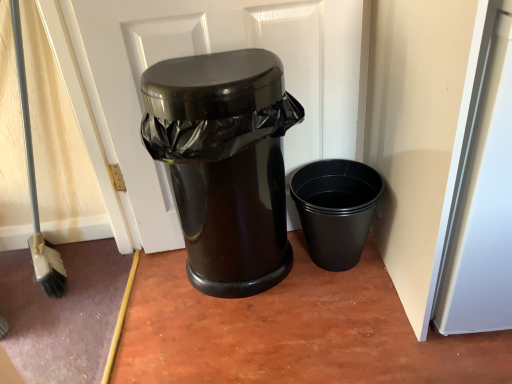
Where is `glossy black trash can at center`? This screenshot has width=512, height=384. glossy black trash can at center is located at coordinates (210, 52).

This screenshot has height=384, width=512. Find the location of `glossy black trash can at center`. glossy black trash can at center is located at coordinates (210, 52).

Is point (341, 258) positioned after point (266, 263)?

Yes, it is.

Considering the positions of objects black matte plastic cup at right, positioned as the second waste container in left-to-right order, and glossy black trash can at center, which is the 1th waste container in left-to-right order, in the image provided, who is more to the right, black matte plastic cup at right, positioned as the second waste container in left-to-right order, or glossy black trash can at center, which is the 1th waste container in left-to-right order,?

black matte plastic cup at right, positioned as the second waste container in left-to-right order.

Could you measure the distance between black matte plastic cup at right, placed as the 1th waste container when sorted from right to left, and glossy black trash can at center, which ranks as the 2th waste container in right-to-left order?

10.42 inches.

From the image's perspective, which waste container is the 2nd one below the glossy black trash can at center? Please provide its 2D coordinates.

[(336, 209)]

Is glossy black trash can at center a part of black matte plastic cup at right, placed as the 1th waste container when sorted from right to left?

No, glossy black trash can at center is not inside black matte plastic cup at right, placed as the 1th waste container when sorted from right to left.

How many degrees apart are the facing directions of black matte plastic cup at right, positioned as the second waste container in left-to-right order, and glossy black trash can at center?

The angular difference between black matte plastic cup at right, positioned as the second waste container in left-to-right order, and glossy black trash can at center is 0.00309 degrees.

Does glossy black trash can at center, which ranks as the 2th waste container in right-to-left order, have a larger size compared to black matte plastic cup at right, placed as the 1th waste container when sorted from right to left?

Indeed, glossy black trash can at center, which ranks as the 2th waste container in right-to-left order, has a larger size compared to black matte plastic cup at right, placed as the 1th waste container when sorted from right to left.

Can you confirm if glossy black trash can at center, which is the 1th waste container in left-to-right order, is wider than black matte plastic cup at right, placed as the 1th waste container when sorted from right to left?

No, glossy black trash can at center, which is the 1th waste container in left-to-right order, is not wider than black matte plastic cup at right, placed as the 1th waste container when sorted from right to left.

Is glossy black trash can at center, which is the 1th waste container in left-to-right order, not within black matte plastic cup at right, positioned as the second waste container in left-to-right order?

Yes, glossy black trash can at center, which is the 1th waste container in left-to-right order, is outside of black matte plastic cup at right, positioned as the second waste container in left-to-right order.

Can you confirm if glossy black trash can at center is wider than glossy black trash can at center, which ranks as the 2th waste container in right-to-left order?

Incorrect, the width of glossy black trash can at center does not surpass that of glossy black trash can at center, which ranks as the 2th waste container in right-to-left order.

From the picture: From the image's perspective, which object appears higher, glossy black trash can at center or glossy black trash can at center, which is the 1th waste container in left-to-right order?

From the image's view, glossy black trash can at center is above.

From a real-world perspective, is glossy black trash can at center positioned over glossy black trash can at center, which is the 1th waste container in left-to-right order, based on gravity?

Correct, in the physical world, glossy black trash can at center is higher than glossy black trash can at center, which is the 1th waste container in left-to-right order.

Is glossy black trash can at center, which is the 1th waste container in left-to-right order, at the back of glossy black trash can at center?

Yes, glossy black trash can at center, which is the 1th waste container in left-to-right order, is at the back of glossy black trash can at center.

Between glossy black trash can at center and black matte plastic cup at right, positioned as the second waste container in left-to-right order, which one appears on the right side from the viewer's perspective?

black matte plastic cup at right, positioned as the second waste container in left-to-right order, is more to the right.

Which is behind, point (233, 30) or point (344, 174)?

The point (344, 174) is more distant.

In terms of size, does glossy black trash can at center appear bigger or smaller than black matte plastic cup at right, placed as the 1th waste container when sorted from right to left?

glossy black trash can at center is bigger than black matte plastic cup at right, placed as the 1th waste container when sorted from right to left.

From the image's perspective, which object appears higher, glossy black trash can at center or black matte plastic cup at right, positioned as the second waste container in left-to-right order?

glossy black trash can at center appears higher in the image.

Is glossy black trash can at center, which ranks as the 2th waste container in right-to-left order, positioned with its back to glossy black trash can at center?

Yes, glossy black trash can at center, which ranks as the 2th waste container in right-to-left order, is positioned with its back facing glossy black trash can at center.

The image size is (512, 384). Identify the location of waste container in front of the glossy black trash can at center. (225, 163).

Does glossy black trash can at center, which ranks as the 2th waste container in right-to-left order, have a larger size compared to glossy black trash can at center?

Yes.

Looking at this image, between glossy black trash can at center, which ranks as the 2th waste container in right-to-left order, and glossy black trash can at center, which one is positioned behind?

glossy black trash can at center is behind.

In the image, there is a glossy black trash can at center, which ranks as the 2th waste container in right-to-left order. At what (x,y) coordinates should I click in order to perform the action: click on waste container below it (from the image's perspective). Please return your answer as a coordinate pair (x, y). The height and width of the screenshot is (384, 512). Looking at the image, I should click on 336,209.

The image size is (512, 384). Find the location of `screen door above the black matte plastic cup at right, positioned as the second waste container in left-to-right order (from the image's perspective)`. screen door above the black matte plastic cup at right, positioned as the second waste container in left-to-right order (from the image's perspective) is located at coordinates (210, 52).

When comparing their distances from black matte plastic cup at right, positioned as the second waste container in left-to-right order, does glossy black trash can at center, which ranks as the 2th waste container in right-to-left order, or glossy black trash can at center seem closer?

glossy black trash can at center, which ranks as the 2th waste container in right-to-left order.

Considering their positions, is glossy black trash can at center positioned further to glossy black trash can at center, which is the 1th waste container in left-to-right order, than black matte plastic cup at right, placed as the 1th waste container when sorted from right to left?

The object further to glossy black trash can at center, which is the 1th waste container in left-to-right order, is black matte plastic cup at right, placed as the 1th waste container when sorted from right to left.

From the image, which object appears to be nearer to black matte plastic cup at right, positioned as the second waste container in left-to-right order, glossy black trash can at center or glossy black trash can at center, which ranks as the 2th waste container in right-to-left order?

glossy black trash can at center, which ranks as the 2th waste container in right-to-left order, lies closer to black matte plastic cup at right, positioned as the second waste container in left-to-right order, than the other object.

Which object lies nearer to the anchor point glossy black trash can at center, which is the 1th waste container in left-to-right order, black matte plastic cup at right, positioned as the second waste container in left-to-right order, or glossy black trash can at center?

Based on the image, glossy black trash can at center appears to be nearer to glossy black trash can at center, which is the 1th waste container in left-to-right order.

Looking at the image, which one is located further to glossy black trash can at center, black matte plastic cup at right, positioned as the second waste container in left-to-right order, or glossy black trash can at center, which ranks as the 2th waste container in right-to-left order?

Based on the image, black matte plastic cup at right, positioned as the second waste container in left-to-right order, appears to be further to glossy black trash can at center.

Based on their spatial positions, is glossy black trash can at center, which is the 1th waste container in left-to-right order, or black matte plastic cup at right, placed as the 1th waste container when sorted from right to left, closer to glossy black trash can at center?

glossy black trash can at center, which is the 1th waste container in left-to-right order, lies closer to glossy black trash can at center than the other object.

Locate an element on the screen. Image resolution: width=512 pixels, height=384 pixels. screen door situated between glossy black trash can at center, which ranks as the 2th waste container in right-to-left order, and black matte plastic cup at right, positioned as the second waste container in left-to-right order, from left to right is located at coordinates (210, 52).